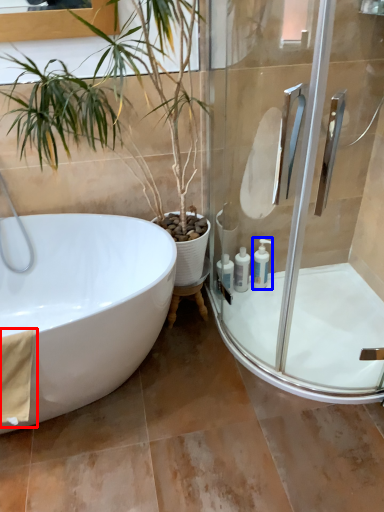
Question: Which object appears closest to the camera in this image, material (highlighted by a red box) or toiletry (highlighted by a blue box)?

Choices:
 (A) material
 (B) toiletry

Answer: (A)